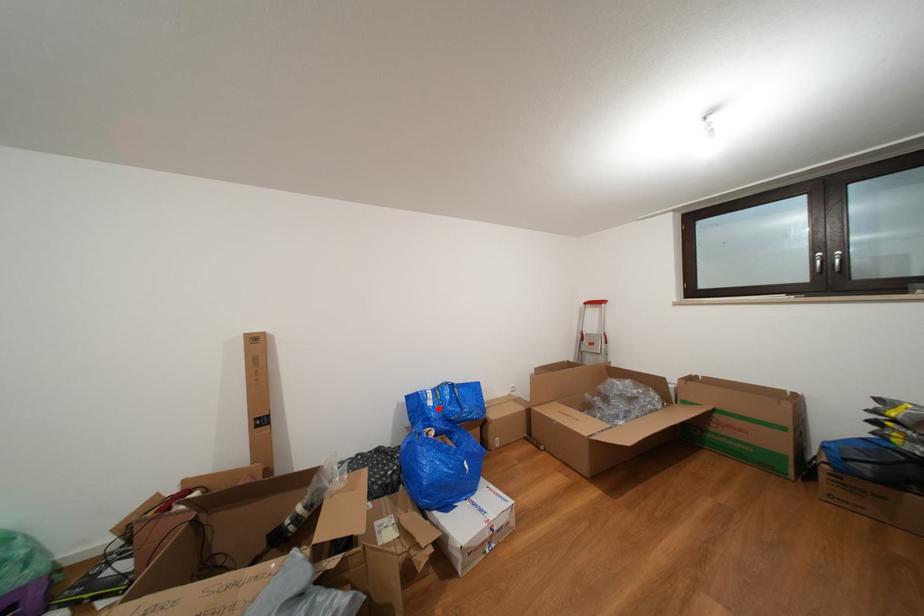
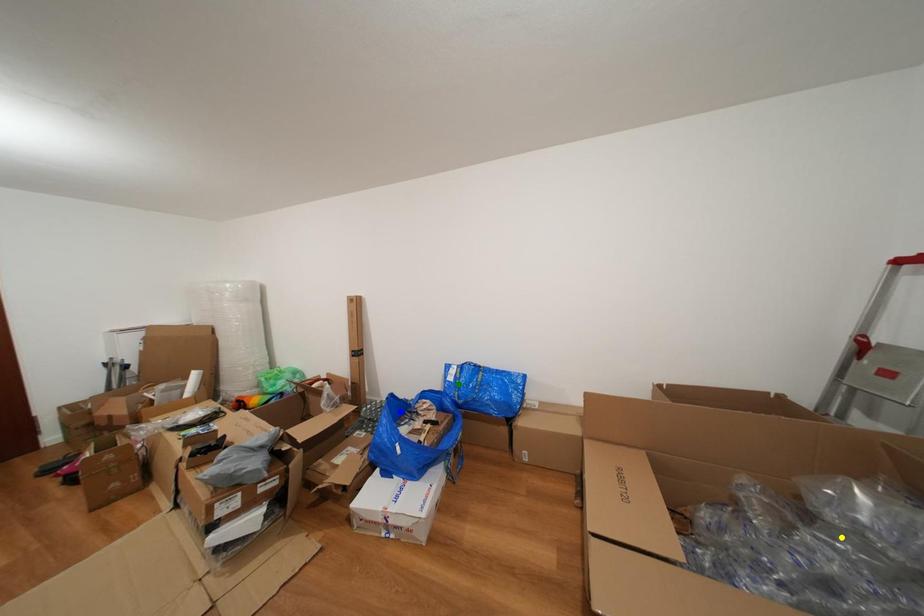
Question: I am providing you with two images of the same scene from different viewpoints. A red point is marked on the first image. You are given multiple points on the second image. In image 2, which mark is for the same physical point as the one in image 1?

Choices:
 (A) blue point
 (B) yellow point
 (C) green point

Answer: (C)